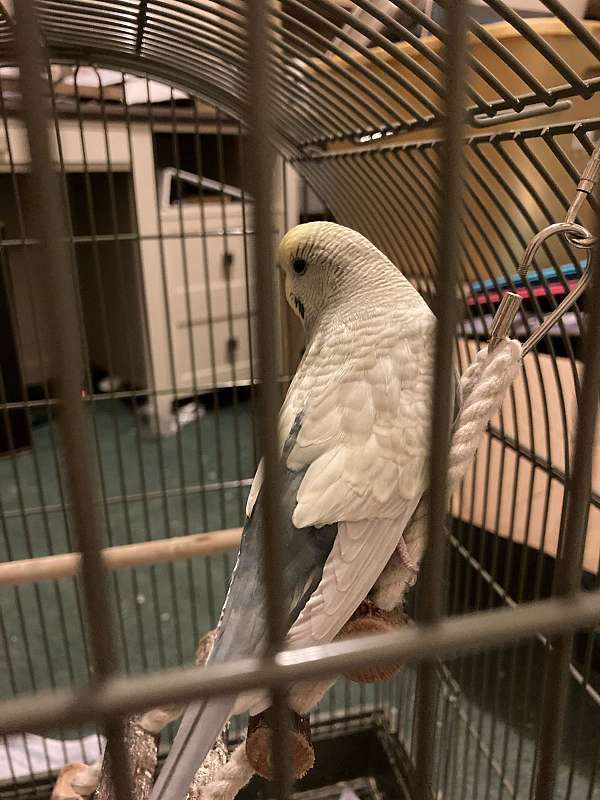
I want to click on middle drawer, so click(x=193, y=272).